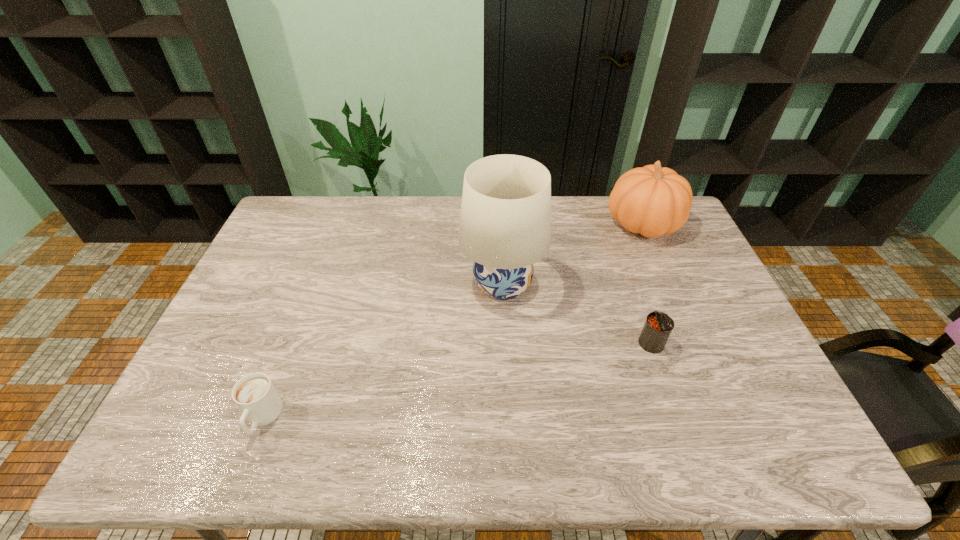
What are the coordinates of `free area in between the second shortest object and the pumpkin` in the screenshot? It's located at (647, 284).

At what (x,y) coordinates should I click in order to perform the action: click on vacant space in between the third object from right to left and the second shortest object. Please return your answer as a coordinate pair (x, y). This screenshot has width=960, height=540. Looking at the image, I should click on (577, 314).

This screenshot has height=540, width=960. In order to click on free space that is in between the third object from right to left and the third tallest object in this screenshot , I will do `click(577, 314)`.

Select which object is the closest to the third farthest object. Please provide its 2D coordinates. Your answer should be formatted as a tuple, i.e. [(x, y)], where the tuple contains the x and y coordinates of a point satisfying the conditions above.

[(505, 223)]

Find the location of `the closest object to the farthest object`. the closest object to the farthest object is located at coordinates (505, 223).

Image resolution: width=960 pixels, height=540 pixels. In order to click on vacant space that satisfies the following two spatial constraints: 1. on the front side of the pumpkin; 2. on the front-facing side of the lampshade in this screenshot , I will do `click(669, 285)`.

This screenshot has height=540, width=960. I want to click on free space that satisfies the following two spatial constraints: 1. on the front-facing side of the second farthest object; 2. on the side with the handle of the nearest object, so click(x=509, y=418).